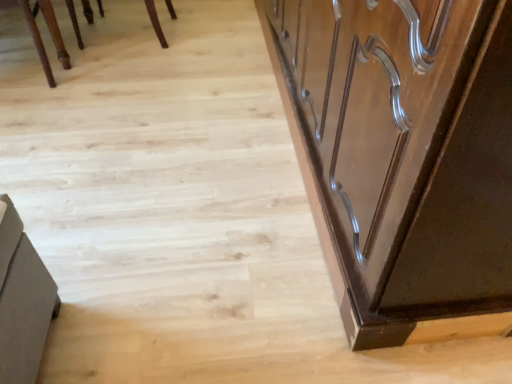
This screenshot has width=512, height=384. In order to click on empty space that is to the right of brown wood chair leg at upper left in this screenshot , I will do `click(101, 72)`.